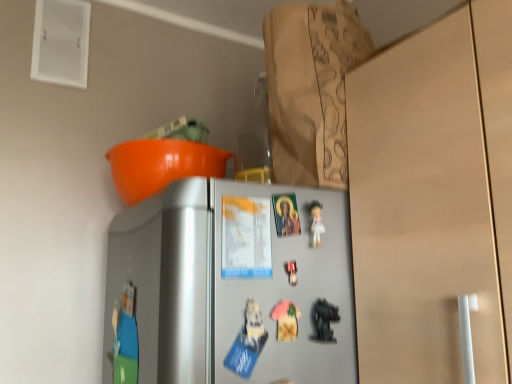
Question: In terms of height, does metallic black toy at lower right, the first toy from the right, look taller or shorter compared to metallic silver toy at center, the second toy from the left?

Choices:
 (A) short
 (B) tall

Answer: (B)

Question: Considering the positions of metallic black toy at lower right, arranged as the 3th toy when viewed from the left, and metallic silver toy at center, the second toy from the left, in the image, is metallic black toy at lower right, arranged as the 3th toy when viewed from the left, bigger or smaller than metallic silver toy at center, the second toy from the left,?

Choices:
 (A) small
 (B) big

Answer: (B)

Question: Based on their relative distances, which object is nearer to the brown paper bag at upper center?

Choices:
 (A) metallic silver toy at center, the second toy from the left
 (B) metallic silver fridge at center
 (C) metallic black toy at lower right, arranged as the 3th toy when viewed from the left
 (D) pink fabric magnet at center, acting as the third toy starting from the right

Answer: (B)

Question: Which object is positioned farthest from the metallic silver fridge at center?

Choices:
 (A) pink fabric magnet at center, the first toy in the left-to-right sequence
 (B) metallic silver toy at center, which is counted as the 2th toy, starting from the right
 (C) brown paper bag at upper center
 (D) metallic black toy at lower right, the first toy from the right

Answer: (C)